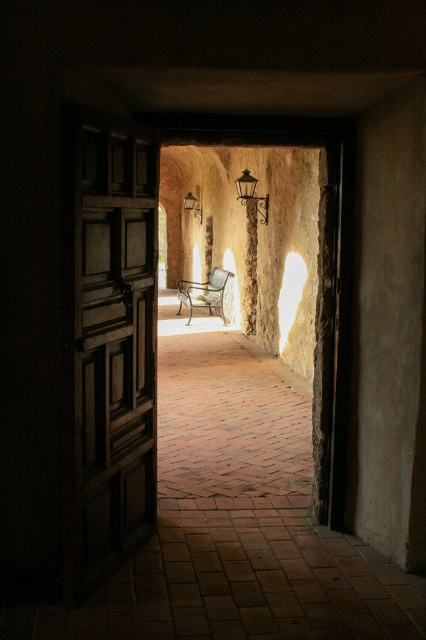
Question: Is wooden panelled door at left smaller than dark brown wrought iron lamp at center?

Choices:
 (A) yes
 (B) no

Answer: (B)

Question: Which object is closer to the camera taking this photo?

Choices:
 (A) dark brown wrought iron lamp at center
 (B) matte black lamp at center
 (C) metallic/golden bench at center
 (D) smooth stone pillar at center

Answer: (A)

Question: From the image, what is the correct spatial relationship of wooden panelled door at left in relation to metallic/golden bench at center?

Choices:
 (A) below
 (B) above

Answer: (A)

Question: Which of the following is the farthest from the observer?

Choices:
 (A) (198, 218)
 (B) (144, 291)
 (C) (198, 289)

Answer: (A)

Question: Does metallic/golden bench at center have a greater width compared to matte black lamp at center?

Choices:
 (A) no
 (B) yes

Answer: (B)

Question: Which of the following is the farthest from the observer?

Choices:
 (A) (250, 288)
 (B) (252, 188)
 (C) (219, 308)

Answer: (C)